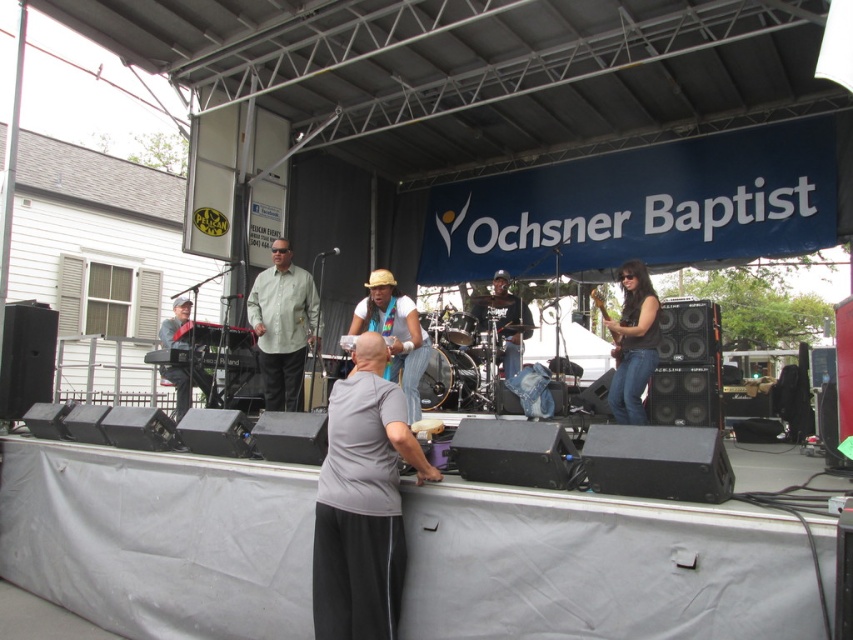
You are a stagehand who needs to retrieve the matte straw hat at center and the wooden electric guitar at center during a performance. Which object is closer to the ground?

The matte straw hat at center is closer to the ground because it is below the wooden electric guitar at center.

You are a photographer positioned behind the stage. You need to capture a clear shot of both the matte green shirt at center and the wooden electric guitar at center. Which object will appear closer to the camera in the photo?

The matte green shirt at center will appear closer to the camera in the photo because it is positioned further to the viewer than the wooden electric guitar at center, meaning it is nearer to the photographer.

You are a photographer trying to capture a closeup of the wooden electric guitar at center. There is a matte straw hat at center blocking your view. Which direction should you move your camera to avoid the hat?

The matte straw hat at center is positioned on the left side of the wooden electric guitar at center. To avoid the hat, move your camera to the right side of the guitar.